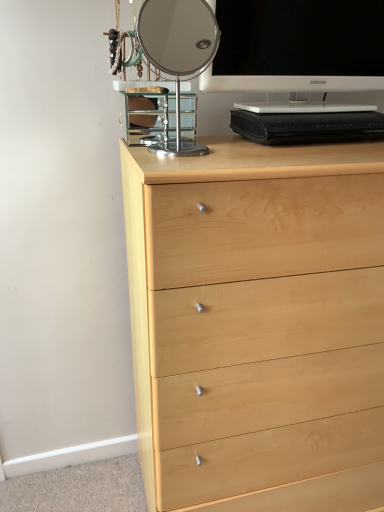
Find the location of `natural wood drawer at lower center`. natural wood drawer at lower center is located at coordinates [x=268, y=458].

Measure the distance between point [281,305] and camera.

37.68 inches.

Measure the distance between point (165, 62) and camera.

They are 6.55 feet apart.

Where is `natural wood drawer at lower center`? The image size is (384, 512). natural wood drawer at lower center is located at coordinates (268, 458).

Is point (239, 455) positioned before point (195, 33)?

Yes, it is in front of point (195, 33).

Are light wood chest of drawers at center and polished chrome mirror at upper center making contact?

No, light wood chest of drawers at center is not with polished chrome mirror at upper center.

From the image's perspective, which object appears higher, light wood chest of drawers at center or polished chrome mirror at upper center?

polished chrome mirror at upper center is shown above in the image.

In the scene shown: Considering the positions of objects light wood chest of drawers at center and polished chrome mirror at upper center in the image provided, who is more to the right, light wood chest of drawers at center or polished chrome mirror at upper center?

light wood chest of drawers at center.

In the scene shown: From the image's perspective, which is below, polished chrome mirror at upper center or light wood chest of drawers at center?

light wood chest of drawers at center.

In terms of width, does polished chrome mirror at upper center look wider or thinner when compared to light wood chest of drawers at center?

Clearly, polished chrome mirror at upper center has less width compared to light wood chest of drawers at center.

Which of these two, polished chrome mirror at upper center or light wood chest of drawers at center, stands taller?

With more height is light wood chest of drawers at center.

From the picture: From a real-world perspective, does polished chrome mirror at upper center stand above light wood chest of drawers at center?

Indeed, from a real-world perspective, polished chrome mirror at upper center stands above light wood chest of drawers at center.

Is white glossy television at upper right placed right next to natural wood drawer at lower center?

No, white glossy television at upper right is not in contact with natural wood drawer at lower center.

From a real-world perspective, which object stands above the other?

From a 3D spatial view, white glossy television at upper right is above.

Does white glossy television at upper right contain natural wood drawer at lower center?

No, white glossy television at upper right does not contain natural wood drawer at lower center.

Considering the relative sizes of light wood chest of drawers at center and white glossy television at upper right in the image provided, is light wood chest of drawers at center shorter than white glossy television at upper right?

No, light wood chest of drawers at center is not shorter than white glossy television at upper right.

Can you confirm if light wood chest of drawers at center is positioned to the left of white glossy television at upper right?

Indeed, light wood chest of drawers at center is positioned on the left side of white glossy television at upper right.

Is light wood chest of drawers at center bigger or smaller than white glossy television at upper right?

Clearly, light wood chest of drawers at center is larger in size than white glossy television at upper right.

Does point (320, 97) lie behind point (275, 300)?

That is True.

Visually, is white glossy television at upper right positioned to the left or to the right of light wood chest of drawers at center?

From the image, it's evident that white glossy television at upper right is to the right of light wood chest of drawers at center.

Is white glossy television at upper right wider than light wood chest of drawers at center?

In fact, white glossy television at upper right might be narrower than light wood chest of drawers at center.

Which object is more forward, white glossy television at upper right or light wood chest of drawers at center?

light wood chest of drawers at center is closer to the camera.

Is white glossy television at upper right beside polished chrome mirror at upper center?

No, white glossy television at upper right is not making contact with polished chrome mirror at upper center.

In the image, is white glossy television at upper right positioned in front of or behind polished chrome mirror at upper center?

Clearly, white glossy television at upper right is behind polished chrome mirror at upper center.

Would you say polished chrome mirror at upper center is part of white glossy television at upper right's contents?

No, polished chrome mirror at upper center is not surrounded by white glossy television at upper right.

Is white glossy television at upper right facing away from polished chrome mirror at upper center?

No.

From the image's perspective, between polished chrome mirror at upper center and natural wood drawer at lower center, who is located below?

natural wood drawer at lower center.

From a real-world perspective, is polished chrome mirror at upper center positioned above or below natural wood drawer at lower center?

In terms of real-world spatial position, polished chrome mirror at upper center is above natural wood drawer at lower center.

You are a GUI agent. You are given a task and a screenshot of the screen. Output one action in this format:
    pyautogui.click(x=<x>, y=<y>)
    Task: Click on the drawer below the polished chrome mirror at upper center (from a real-world perspective)
    This screenshot has height=512, width=384.
    Given the screenshot: What is the action you would take?
    pyautogui.click(x=268, y=458)

Where is `table lamp that appears behind the light wood chest of drawers at center`? This screenshot has height=512, width=384. table lamp that appears behind the light wood chest of drawers at center is located at coordinates (178, 53).

Locate an element on the screen. The width and height of the screenshot is (384, 512). the chest of drawers in front of the polished chrome mirror at upper center is located at coordinates (254, 322).

Which object lies further to the anchor point polished chrome mirror at upper center, natural wood drawer at lower center or light wood chest of drawers at center?

natural wood drawer at lower center.

Estimate the real-world distances between objects in this image. Which object is closer to white glossy television at upper right, polished chrome mirror at upper center or natural wood drawer at lower center?

polished chrome mirror at upper center is positioned closer to the anchor white glossy television at upper right.

From the image, which object appears to be farther from natural wood drawer at lower center, polished chrome mirror at upper center or light wood chest of drawers at center?

Based on the image, polished chrome mirror at upper center appears to be further to natural wood drawer at lower center.

Estimate the real-world distances between objects in this image. Which object is closer to white glossy television at upper right, light wood chest of drawers at center or polished chrome mirror at upper center?

light wood chest of drawers at center lies closer to white glossy television at upper right than the other object.

Considering their positions, is white glossy television at upper right positioned closer to polished chrome mirror at upper center than natural wood drawer at lower center?

Among the two, white glossy television at upper right is located nearer to polished chrome mirror at upper center.

Looking at the image, which one is located further to white glossy television at upper right, natural wood drawer at lower center or polished chrome mirror at upper center?

natural wood drawer at lower center is positioned further to the anchor white glossy television at upper right.

Based on their spatial positions, is light wood chest of drawers at center or white glossy television at upper right further from polished chrome mirror at upper center?

light wood chest of drawers at center lies further to polished chrome mirror at upper center than the other object.

Based on their spatial positions, is polished chrome mirror at upper center or white glossy television at upper right further from light wood chest of drawers at center?

The object further to light wood chest of drawers at center is polished chrome mirror at upper center.

Where is `the chest of drawers between white glossy television at upper right and natural wood drawer at lower center vertically`? the chest of drawers between white glossy television at upper right and natural wood drawer at lower center vertically is located at coordinates (254, 322).

Where is `table lamp between white glossy television at upper right and natural wood drawer at lower center from top to bottom`? The height and width of the screenshot is (512, 384). table lamp between white glossy television at upper right and natural wood drawer at lower center from top to bottom is located at coordinates (178, 53).

Where is `table lamp between white glossy television at upper right and light wood chest of drawers at center from top to bottom`? table lamp between white glossy television at upper right and light wood chest of drawers at center from top to bottom is located at coordinates (178, 53).

Find the location of a particular element. the chest of drawers between polished chrome mirror at upper center and natural wood drawer at lower center vertically is located at coordinates (254, 322).